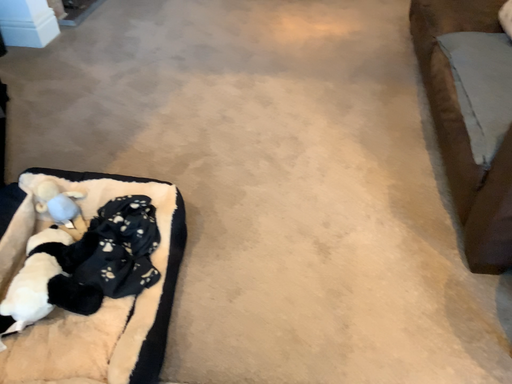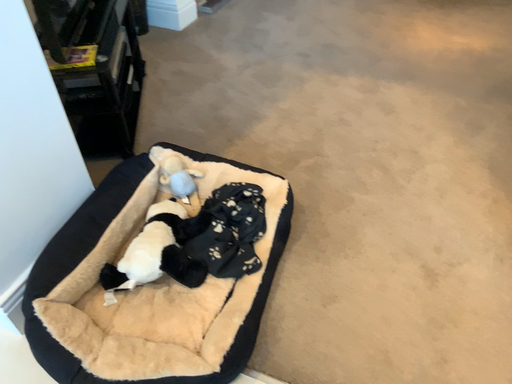
Question: How did the camera likely rotate when shooting the video?

Choices:
 (A) rotated left
 (B) rotated right

Answer: (A)